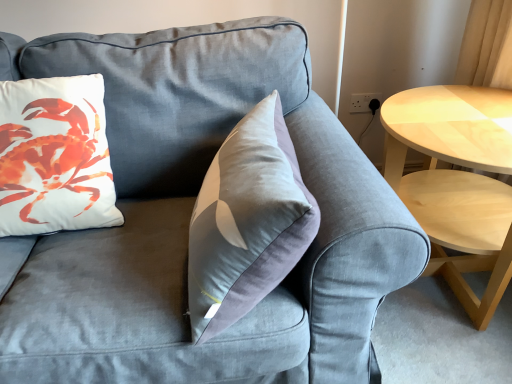
Question: Is white matte pillow at upper left further to the viewer compared to light wood/woodenobject at right?

Choices:
 (A) no
 (B) yes

Answer: (A)

Question: Does white matte pillow at upper left lie in front of light wood/woodenobject at right?

Choices:
 (A) no
 (B) yes

Answer: (B)

Question: Is white matte pillow at upper left wider than light wood/woodenobject at right?

Choices:
 (A) no
 (B) yes

Answer: (A)

Question: Considering the relative sizes of white matte pillow at upper left and light wood/woodenobject at right in the image provided, is white matte pillow at upper left bigger than light wood/woodenobject at right?

Choices:
 (A) no
 (B) yes

Answer: (A)

Question: From the image's perspective, is white matte pillow at upper left located beneath light wood/woodenobject at right?

Choices:
 (A) no
 (B) yes

Answer: (A)

Question: Does white matte pillow at upper left contain light wood/woodenobject at right?

Choices:
 (A) no
 (B) yes

Answer: (A)

Question: Can you confirm if light wood/woodenobject at right is smaller than white matte pillow at upper left?

Choices:
 (A) yes
 (B) no

Answer: (B)

Question: Is light wood/woodenobject at right to the left of white matte pillow at upper left from the viewer's perspective?

Choices:
 (A) no
 (B) yes

Answer: (A)

Question: Does light wood/woodenobject at right lie behind white matte pillow at upper left?

Choices:
 (A) yes
 (B) no

Answer: (A)

Question: Is light wood/woodenobject at right at the right side of white matte pillow at upper left?

Choices:
 (A) yes
 (B) no

Answer: (A)

Question: Is white matte pillow at upper left a part of light wood/woodenobject at right?

Choices:
 (A) no
 (B) yes

Answer: (A)

Question: From a real-world perspective, is light wood/woodenobject at right beneath white matte pillow at upper left?

Choices:
 (A) yes
 (B) no

Answer: (A)

Question: Considering their positions, is light wood/woodenobject at right located in front of or behind white matte pillow at upper left?

Choices:
 (A) front
 (B) behind

Answer: (B)